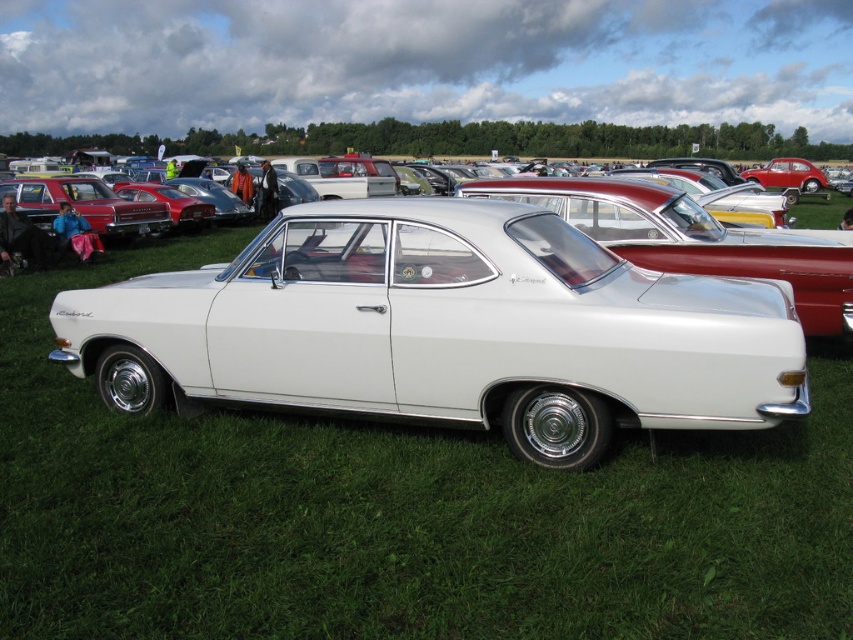
Question: Which of the following is the closest to the observer?

Choices:
 (A) shiny red car at center
 (B) white glossy sedan at center

Answer: (B)

Question: Which object is closer to the camera taking this photo?

Choices:
 (A) white glossy sedan at center
 (B) shiny red car at center
 (C) matte red car at left
 (D) white glossy car at center

Answer: (D)

Question: In this image, where is white glossy car at center located relative to white glossy sedan at center?

Choices:
 (A) left
 (B) right

Answer: (A)

Question: Is white glossy car at center thinner than matte red car at left?

Choices:
 (A) no
 (B) yes

Answer: (A)

Question: Observing the image, what is the correct spatial positioning of matte red car at left in reference to shiny red car at center?

Choices:
 (A) below
 (B) above

Answer: (A)

Question: Which point appears farthest from the camera in this image?

Choices:
 (A) (844, 276)
 (B) (569, 250)

Answer: (A)